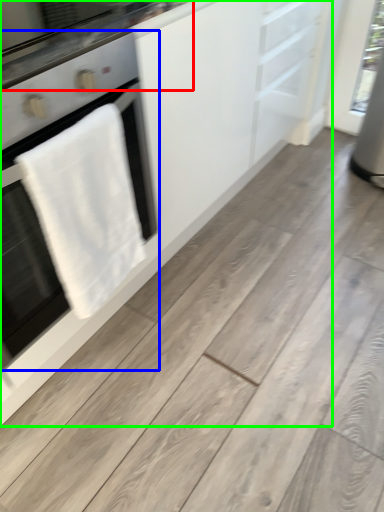
Question: Estimate the real-world distances between objects in this image. Which object is closer to countertop (highlighted by a red box), home appliance (highlighted by a blue box) or cabinetry (highlighted by a green box)?

Choices:
 (A) home appliance
 (B) cabinetry

Answer: (A)